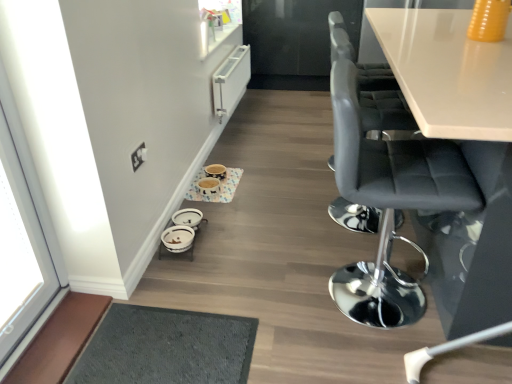
Question: Which direction should I rotate to look at matte ceramic bowls at center, positioned as the 1th round table in top-to-bottom order?

Choices:
 (A) left
 (B) right

Answer: (A)

Question: Does matte ceramic bowls at center, the first round table positioned from the back, have a greater height compared to white glass window at left?

Choices:
 (A) no
 (B) yes

Answer: (A)

Question: From a real-world perspective, is matte ceramic bowls at center, the first round table positioned from the back, located beneath white glass window at left?

Choices:
 (A) no
 (B) yes

Answer: (B)

Question: Can you confirm if matte ceramic bowls at center, which is the second round table from bottom to top, is thinner than white glass window at left?

Choices:
 (A) no
 (B) yes

Answer: (A)

Question: Is matte ceramic bowls at center, the second round table in the front-to-back sequence, located outside white glass window at left?

Choices:
 (A) no
 (B) yes

Answer: (B)

Question: Is matte ceramic bowls at center, the second round table in the front-to-back sequence, facing away from white glass window at left?

Choices:
 (A) no
 (B) yes

Answer: (A)

Question: Is matte ceramic bowls at center, positioned as the 1th round table in top-to-bottom order, facing towards white glass window at left?

Choices:
 (A) yes
 (B) no

Answer: (B)

Question: Considering the relative sizes of white glass window at left and matte ceramic bowls at center, positioned as the 1th round table in top-to-bottom order, in the image provided, is white glass window at left smaller than matte ceramic bowls at center, positioned as the 1th round table in top-to-bottom order,?

Choices:
 (A) yes
 (B) no

Answer: (B)

Question: Is white glass window at left far from matte ceramic bowls at center, which is the second round table from bottom to top?

Choices:
 (A) yes
 (B) no

Answer: (B)

Question: Is white glass window at left facing away from matte ceramic bowls at center, which is the second round table from bottom to top?

Choices:
 (A) yes
 (B) no

Answer: (B)

Question: Considering the relative positions of white glass window at left and matte ceramic bowls at center, the second round table in the front-to-back sequence, in the image provided, is white glass window at left to the right of matte ceramic bowls at center, the second round table in the front-to-back sequence, from the viewer's perspective?

Choices:
 (A) no
 (B) yes

Answer: (A)

Question: Can you confirm if white glass window at left is thinner than matte ceramic bowls at center, which is the second round table from bottom to top?

Choices:
 (A) no
 (B) yes

Answer: (B)

Question: Could matte ceramic bowls at center, positioned as the 1th round table in top-to-bottom order, be considered to be inside white glass window at left?

Choices:
 (A) yes
 (B) no

Answer: (B)

Question: Can you see gray fabric chair at right, the 2th chair viewed from the front, touching white glass window at left?

Choices:
 (A) yes
 (B) no

Answer: (B)